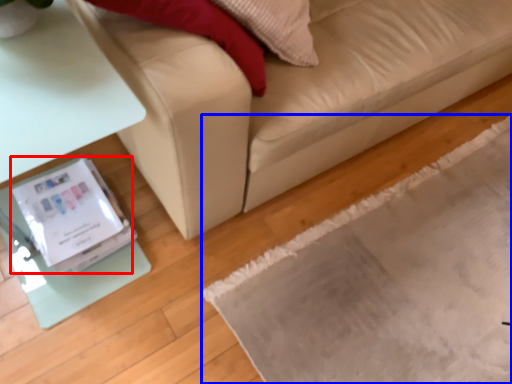
Question: Which object is closer to the camera taking this photo, Wii (highlighted by a red box) or mat (highlighted by a blue box)?

Choices:
 (A) Wii
 (B) mat

Answer: (B)